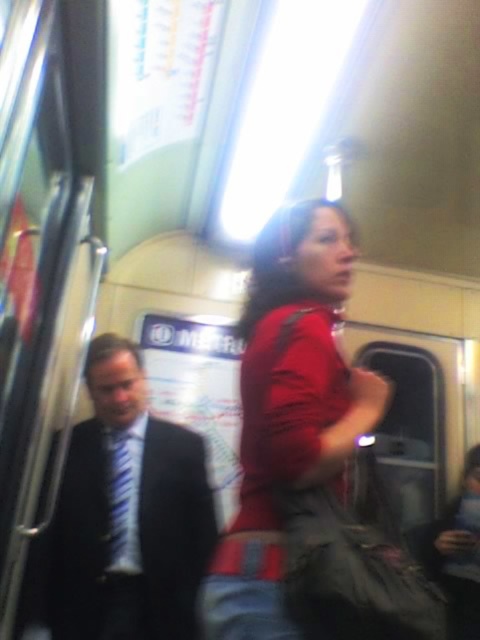
You are a photographer trying to capture a clear shot of the matte red shirt at center from your current position. Given that your camera has a minimum focusing distance of 30 inches, will you be able to take a sharp photo without moving closer?

The matte red shirt at center and camera are 32.89 inches apart, which is beyond the camera minimum focusing distance of 30 inches. Therefore, you can take a sharp photo without moving closer.

You are a passenger on a subway train and see a woman in a matte red shirt at center and a man in a blue striped tie at left. Which of these two is positioned more to the right side of the scene?

The matte red shirt at center is positioned to the right of the blue striped tie at left, so the matte red shirt at center is more to the right side of the scene.

You are a passenger on a subway train and notice two people in the scene described. The woman wearing the matte red shirt at center and the man with the blue striped tie at left. From your perspective, which of these two individuals is closer to you?

The matte red shirt at center is closer to you because it is positioned in front of the blue striped tie at left.